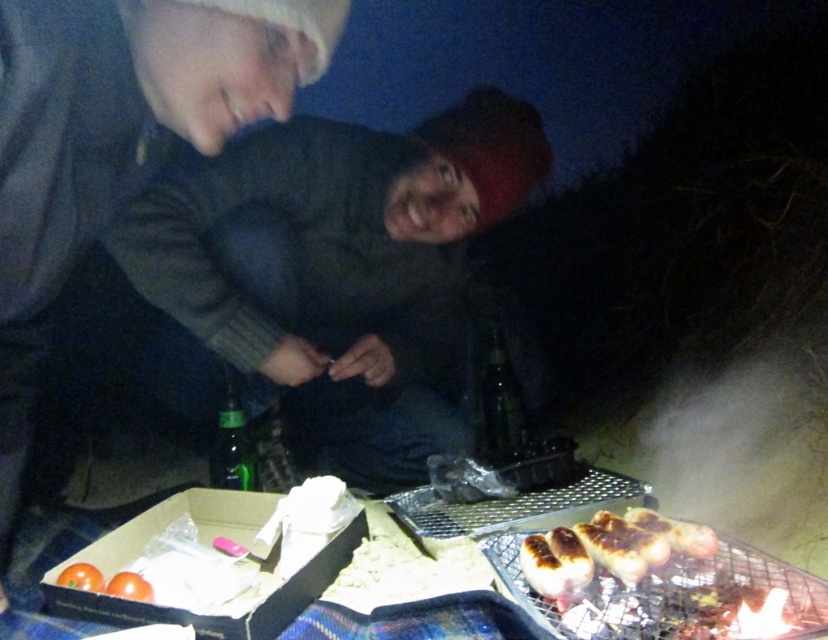
Which is more to the left, dark gray sweater at upper left or orange matte tomato at lower left?

From the viewer's perspective, dark gray sweater at upper left appears more on the left side.

Can you confirm if dark gray sweater at upper left is positioned above orange matte tomato at lower left?

Yes, dark gray sweater at upper left is above orange matte tomato at lower left.

Who is more distant from viewer, (166, 125) or (138, 598)?

Point (138, 598)

The height and width of the screenshot is (640, 828). Find the location of `dark gray sweater at upper left`. dark gray sweater at upper left is located at coordinates (118, 138).

Consider the image. Is dark gray sweater at upper left above smooth orange tomato at lower left?

Yes.

Is point (47, 282) closer to camera compared to point (58, 582)?

Yes, point (47, 282) is closer to viewer.

Find the location of a particular element. This screenshot has width=828, height=640. dark gray sweater at upper left is located at coordinates (118, 138).

In the scene shown: Who is more distant from viewer, (586,528) or (80,579)?

The point (586,528) is behind.

Can you confirm if charred white bread at lower right is positioned to the left of smooth orange tomato at lower left?

Incorrect, charred white bread at lower right is not on the left side of smooth orange tomato at lower left.

Is point (555, 540) more distant than point (82, 564)?

No, (555, 540) is closer to viewer.

The width and height of the screenshot is (828, 640). In order to click on charred white bread at lower right in this screenshot , I will do `click(609, 548)`.